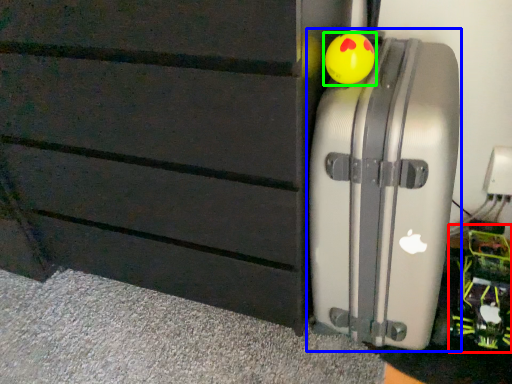
Question: Based on their relative distances, which object is nearer to toy (highlighted by a red box)? Choose from suitcase (highlighted by a blue box) and toy (highlighted by a green box).

Choices:
 (A) suitcase
 (B) toy

Answer: (A)